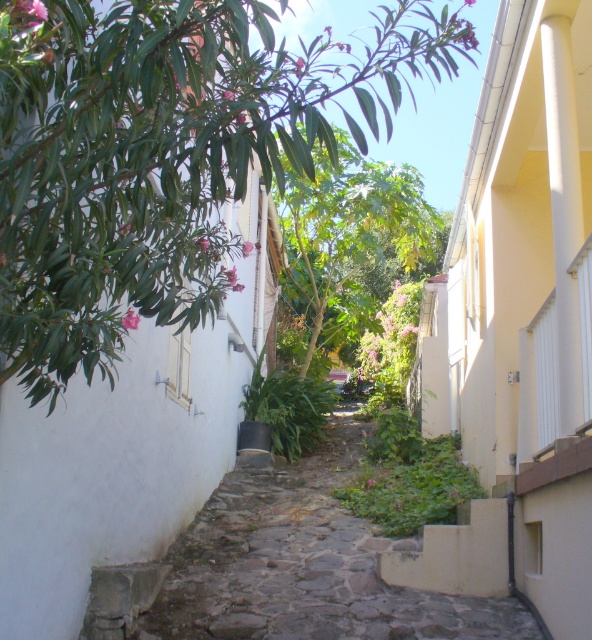
Question: Which object appears farthest from the camera in this image?

Choices:
 (A) green leafy tree at upper left
 (B) stone cobblestone path at center

Answer: (B)

Question: Can you confirm if green leafy tree at upper left is positioned above green leafy tree at center?

Choices:
 (A) no
 (B) yes

Answer: (B)

Question: Is green leafy tree at upper left wider than stone cobblestone path at center?

Choices:
 (A) no
 (B) yes

Answer: (B)

Question: Among these objects, which one is nearest to the camera?

Choices:
 (A) stone cobblestone path at center
 (B) green leafy tree at upper left

Answer: (B)

Question: Which object appears farthest from the camera in this image?

Choices:
 (A) stone cobblestone path at center
 (B) green leafy tree at upper left

Answer: (A)

Question: Is stone cobblestone path at center further to camera compared to green leafy tree at center?

Choices:
 (A) yes
 (B) no

Answer: (B)